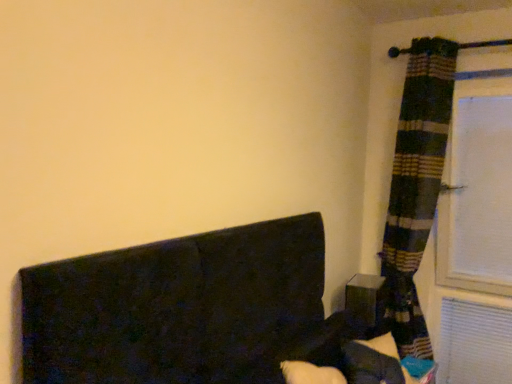
Question: Should I look upward or downward to see matte black cube at right?

Choices:
 (A) up
 (B) down

Answer: (B)